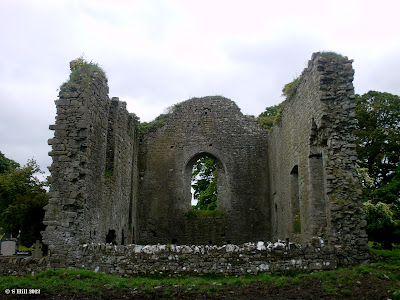
Locate an element on the screen. floor is located at coordinates point(186,246).